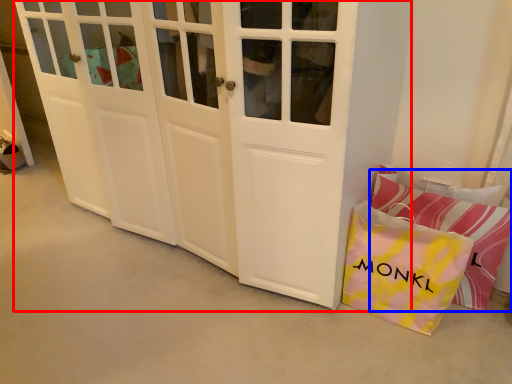
Question: Which point is further to the camera, door (highlighted by a red box) or pillow (highlighted by a blue box)?

Choices:
 (A) door
 (B) pillow

Answer: (B)